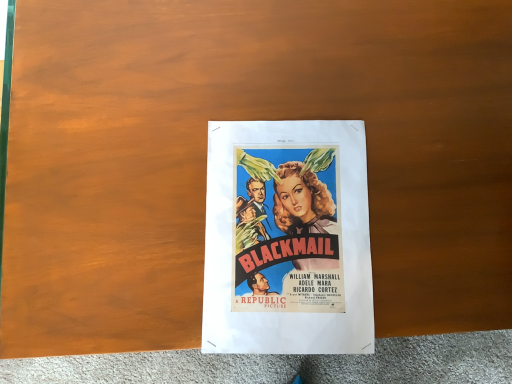
The image size is (512, 384). I want to click on matte paper poster at center, so click(287, 239).

The height and width of the screenshot is (384, 512). Describe the element at coordinates (287, 239) in the screenshot. I see `matte paper poster at center` at that location.

I want to click on matte paper poster at center, so click(x=287, y=239).